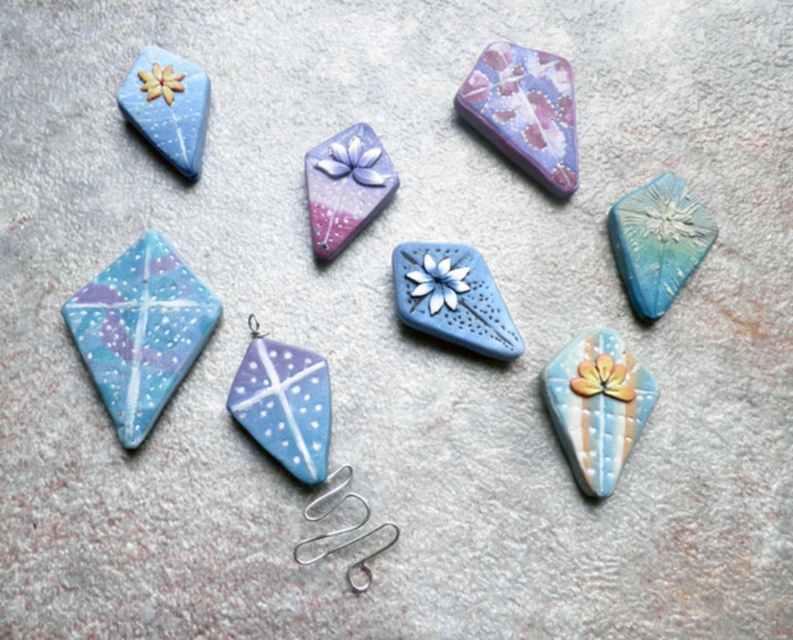
You are an interior designer arranging these pendants on a wall. You have the pastel glossy square at upper center and the matte blue clay pendant at center. Which pendant is placed above the other?

The pastel glossy square at upper center is positioned over matte blue clay pendant at center, so it is placed above the matte blue clay pendant at center.

You are holding a measuring tool and want to determine if a point labeled as point (136, 444) on one of the pendants is within a safe distance for detailed inspection without risking damage. The safe distance for handling these delicate items is set at 4 feet. Is the point within the safe distance?

The distance of point (136, 444) from the camera is 4.19 feet, which exceeds the safe handling distance of 4 feet. Therefore, the point is slightly beyond the recommended safe distance for detailed inspection.